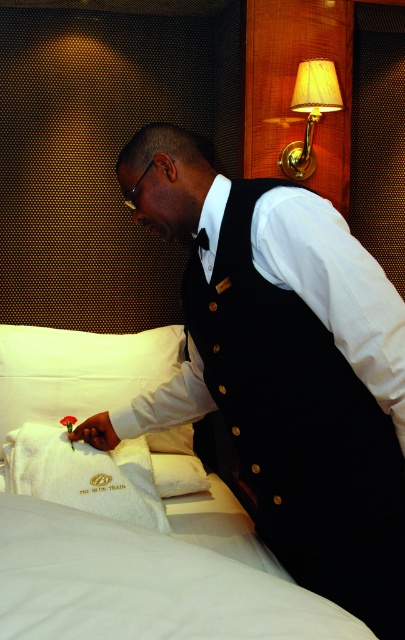
You are a passenger in the luxurious train cabin. You notice a point marked at coordinates (x=281, y=369). What object in the scene corresponds to this point?

The point at coordinates (x=281, y=369) corresponds to the black satin vest at center.